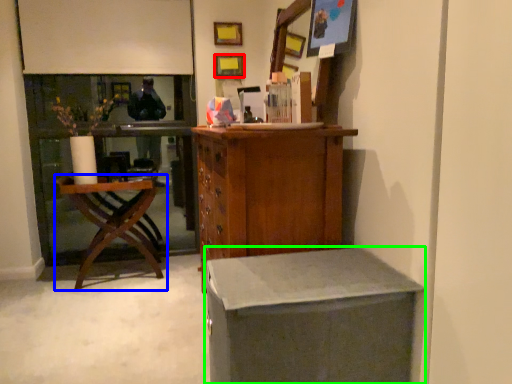
Question: Which object is the farthest from picture frame (highlighted by a red box)? Choose among these: chair (highlighted by a blue box) or desk (highlighted by a green box).

Choices:
 (A) chair
 (B) desk

Answer: (B)